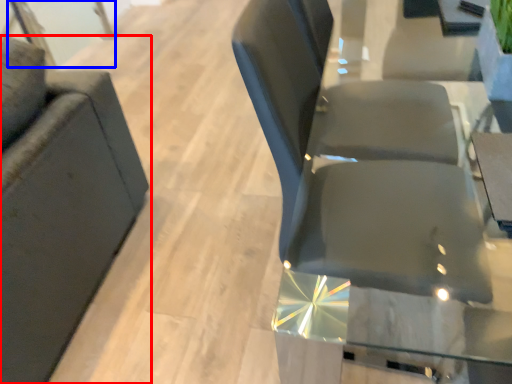
Question: Which object is further to the camera taking this photo, chair (highlighted by a red box) or glass door (highlighted by a blue box)?

Choices:
 (A) chair
 (B) glass door

Answer: (B)